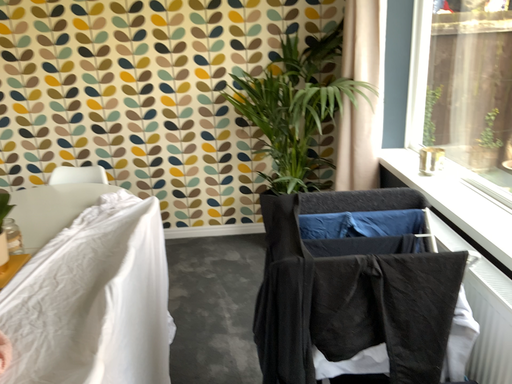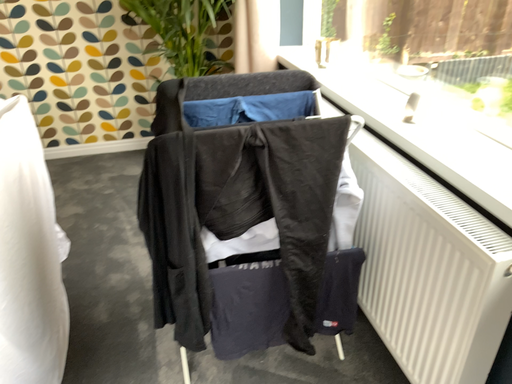
Question: How did the camera likely rotate when shooting the video?

Choices:
 (A) rotated right
 (B) rotated left

Answer: (A)